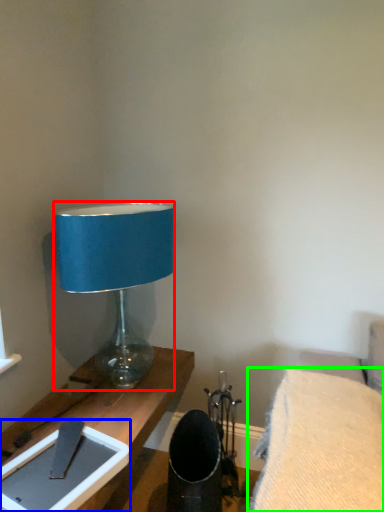
Question: Considering the real-world distances, which object is closest to lamp (highlighted by a red box)? tablet computer (highlighted by a blue box) or furniture (highlighted by a green box).

Choices:
 (A) tablet computer
 (B) furniture

Answer: (A)